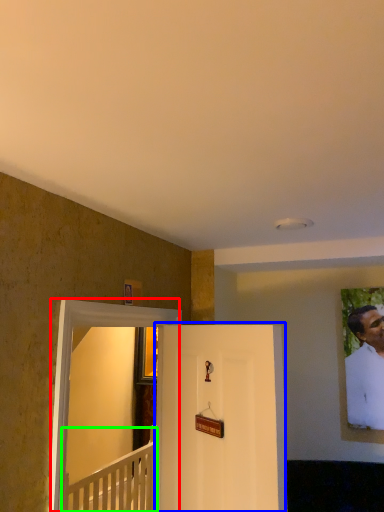
Question: Based on their relative distances, which object is nearer to glass door (highlighted by a red box)? Choose from door (highlighted by a blue box) and furniture (highlighted by a green box).

Choices:
 (A) door
 (B) furniture

Answer: (A)